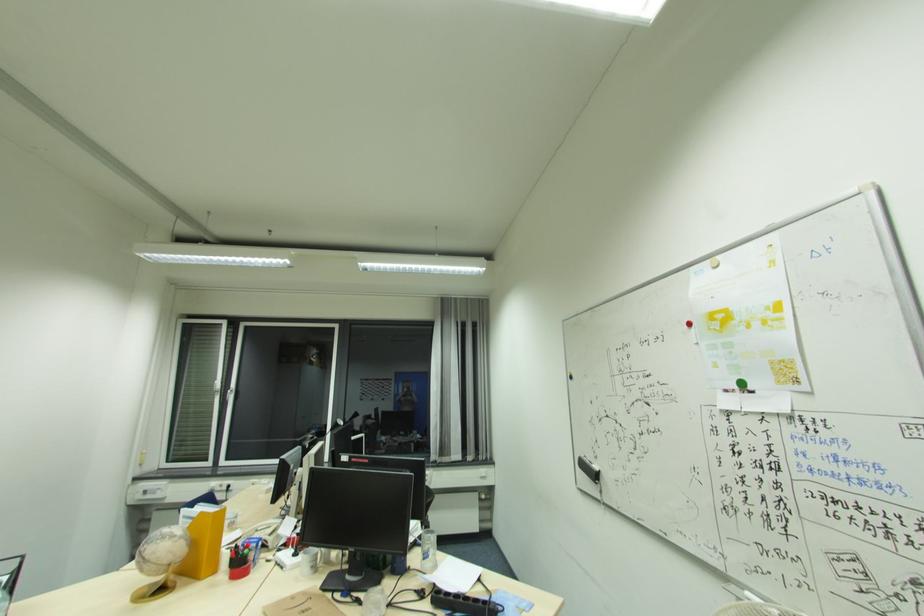
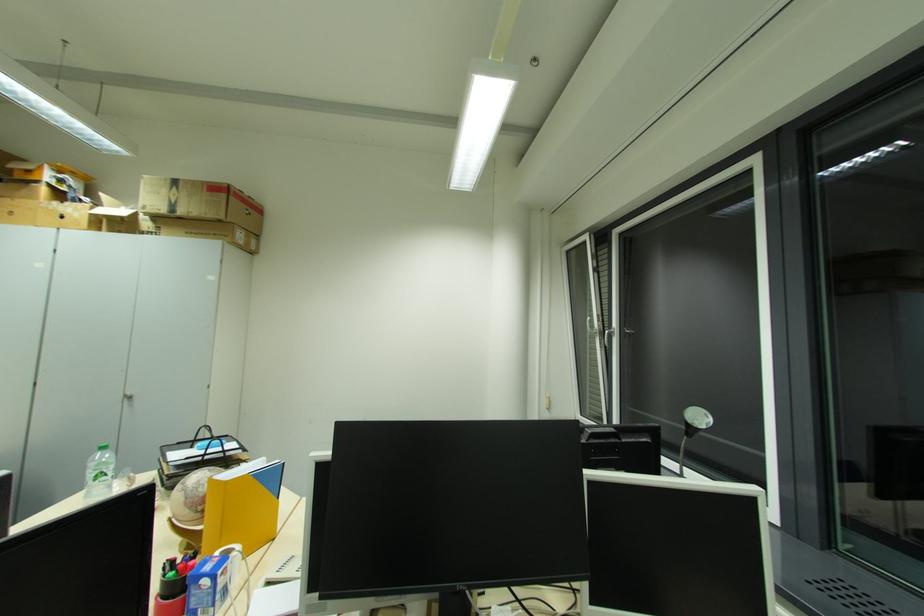
Where in the second image is the point corresponding to point (217, 400) from the first image?

(600, 342)